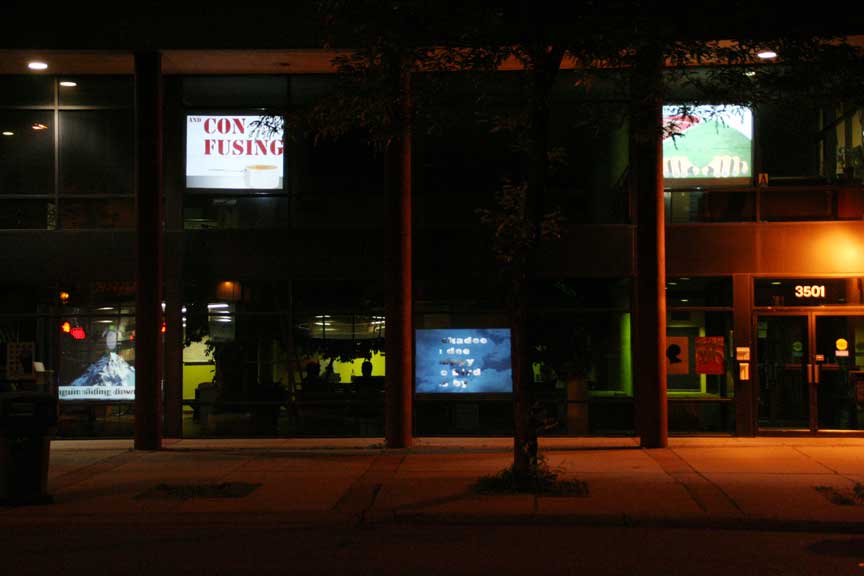
You are a GUI agent. You are given a task and a screenshot of the screen. Output one action in this format:
    pyautogui.click(x=<x>, y=<y>)
    Task: Click on the digital signs
    Image resolution: width=864 pixels, height=576 pixels.
    Given the screenshot: What is the action you would take?
    pyautogui.click(x=478, y=353), pyautogui.click(x=207, y=142)